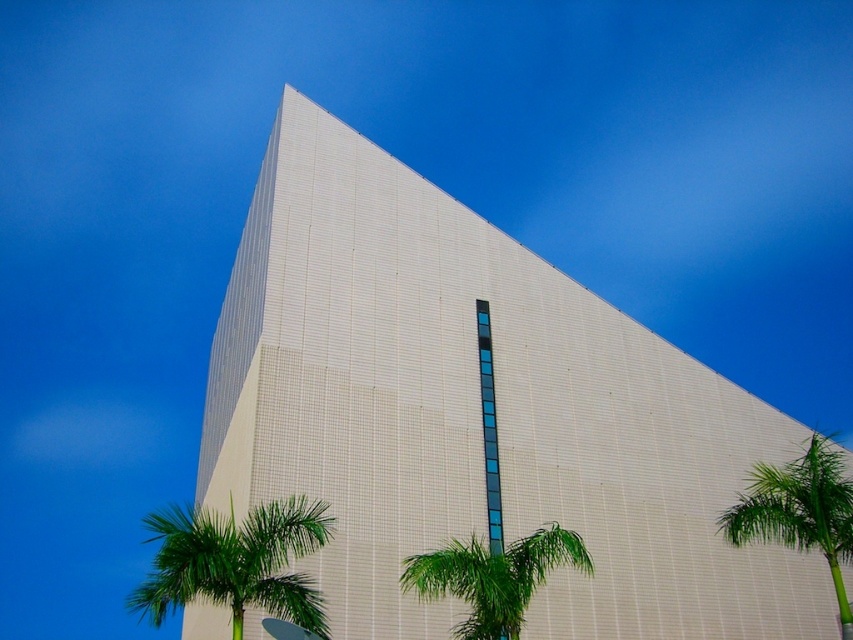
Question: Which point is farther to the camera?

Choices:
 (A) (563, 380)
 (B) (780, 492)
 (C) (230, 554)

Answer: (A)

Question: Estimate the real-world distances between objects in this image. Which object is farther from the green leafy palm tree at lower left?

Choices:
 (A) green leafy palm tree at lower center
 (B) green leafy palm tree at right

Answer: (B)

Question: Where is green leafy palm tree at right located in relation to green leafy palm tree at lower center in the image?

Choices:
 (A) below
 (B) above

Answer: (B)

Question: Can you confirm if white textured building at center is positioned above green leafy palm tree at lower center?

Choices:
 (A) no
 (B) yes

Answer: (B)

Question: Among these points, which one is farthest from the camera?

Choices:
 (A) (660, 506)
 (B) (515, 577)

Answer: (A)

Question: Does green leafy palm tree at right appear over green leafy palm tree at lower center?

Choices:
 (A) no
 (B) yes

Answer: (B)